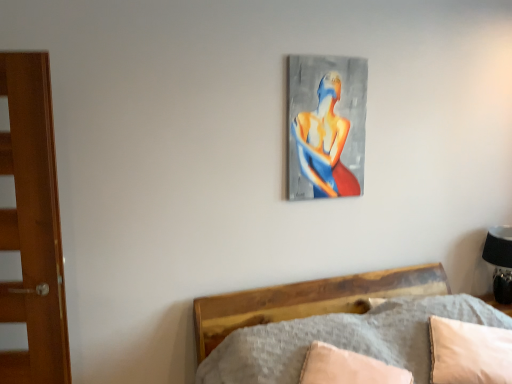
Question: From a real-world perspective, is abstract painting at upper center physically located above or below beige fabric pillow at lower right, arranged as the first pillow when viewed from the left?

Choices:
 (A) below
 (B) above

Answer: (B)

Question: Is abstract painting at upper center wider or thinner than beige fabric pillow at lower right, arranged as the second pillow when viewed from the right?

Choices:
 (A) thin
 (B) wide

Answer: (A)

Question: Estimate the real-world distances between objects in this image. Which object is farther from the beige fabric pillow at lower right, arranged as the second pillow when viewed from the right?

Choices:
 (A) black matte table lamp at right
 (B) beige fabric pillow at lower right, which appears as the 1th pillow when viewed from the right
 (C) abstract painting at upper center

Answer: (A)

Question: Estimate the real-world distances between objects in this image. Which object is closer to the black matte table lamp at right?

Choices:
 (A) beige fabric pillow at lower right, arranged as the second pillow when viewed from the right
 (B) beige fabric pillow at lower right, which appears as the 1th pillow when viewed from the right
 (C) abstract painting at upper center

Answer: (B)